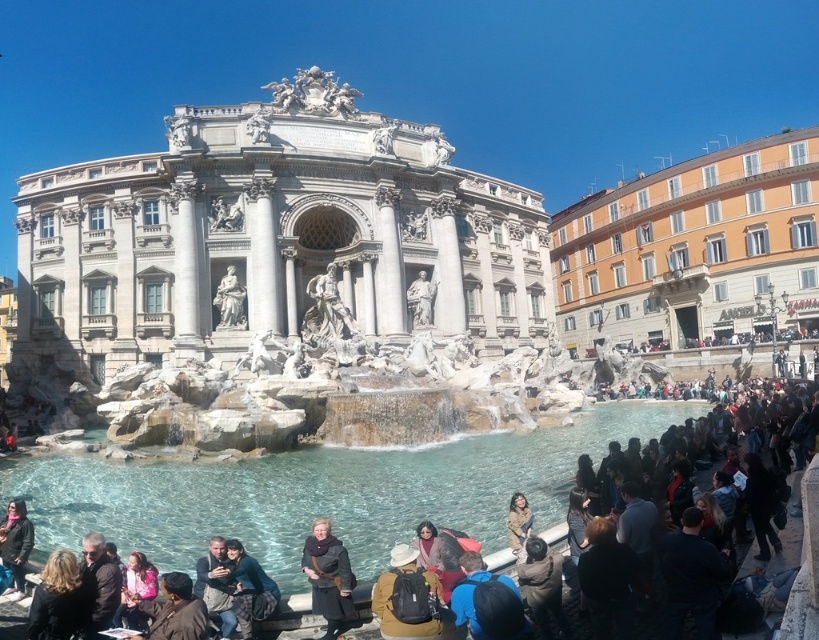
The height and width of the screenshot is (640, 819). What do you see at coordinates (328, 577) in the screenshot? I see `dark brown leather coat at lower center` at bounding box center [328, 577].

Can you confirm if dark brown leather coat at lower center is thinner than dark blue fabric jacket at lower center?

In fact, dark brown leather coat at lower center might be wider than dark blue fabric jacket at lower center.

Between point (320, 598) and point (241, 604), which one is positioned behind?

Point (320, 598)

In order to click on dark brown leather coat at lower center in this screenshot , I will do `click(328, 577)`.

Is dark brown leather jacket at lower left to the right of dark gray knit hat at lower left from the viewer's perspective?

Yes, dark brown leather jacket at lower left is to the right of dark gray knit hat at lower left.

Is dark brown leather jacket at lower left taller than dark gray knit hat at lower left?

No, dark brown leather jacket at lower left is not taller than dark gray knit hat at lower left.

Is point (48, 611) farther from camera compared to point (25, 548)?

No, (48, 611) is closer to viewer.

Identify the location of dark brown leather jacket at lower left. Image resolution: width=819 pixels, height=640 pixels. (57, 598).

Is dark blue fabric jacket at lower center below brown leather jacket at lower center?

Yes.

Is point (275, 598) in front of point (523, 557)?

Yes, it is.

Identify the location of dark blue fabric jacket at lower center. (249, 589).